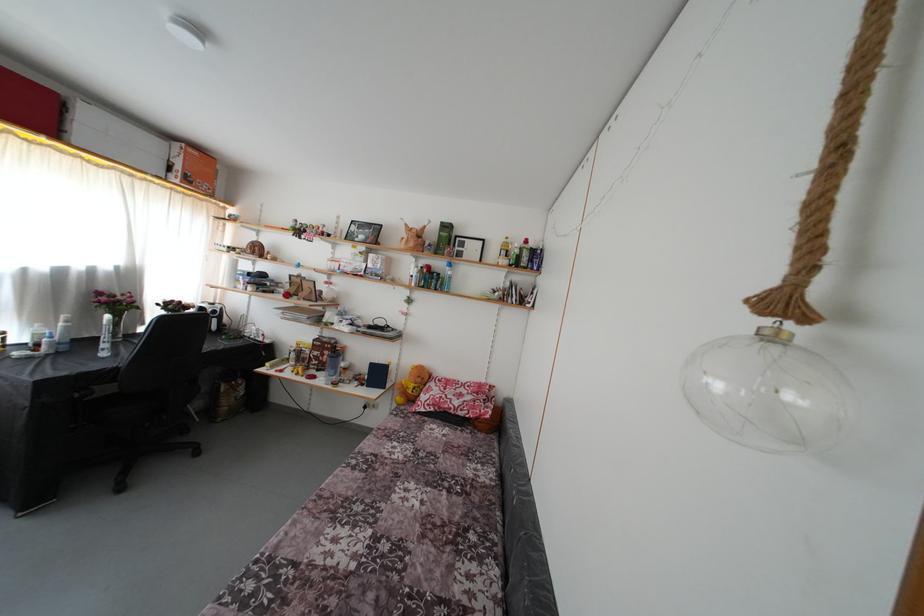
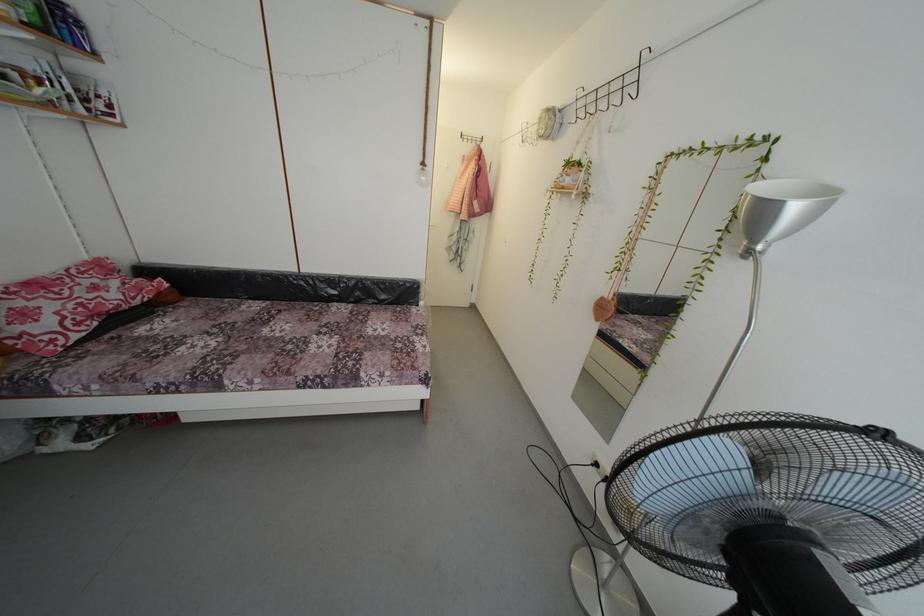
Find the pixel in the second image that matches point (784, 310) in the first image.

(429, 169)